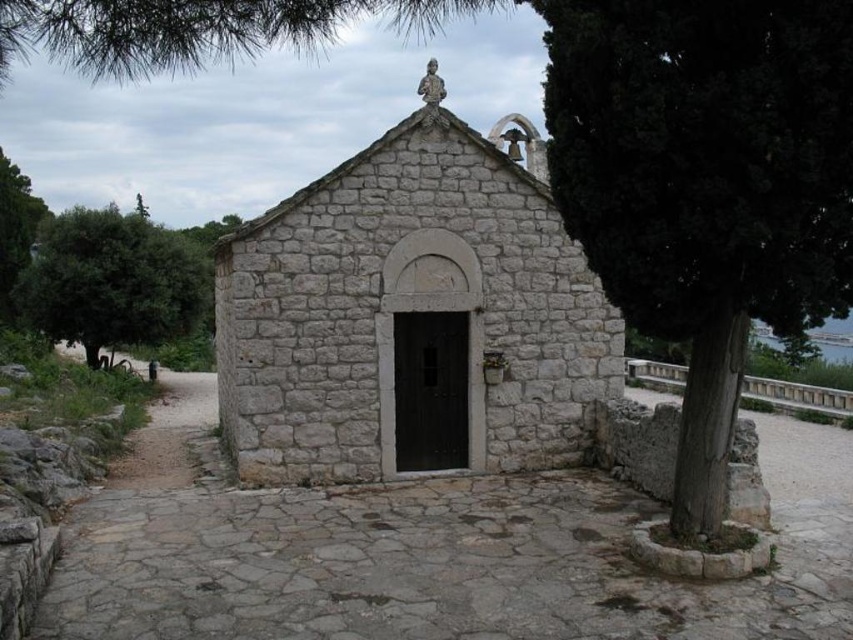
Is gray stone path at center smaller than green leafy tree at left?

Actually, gray stone path at center might be larger than green leafy tree at left.

Can you confirm if gray stone path at center is positioned to the right of green leafy tree at left?

Correct, you'll find gray stone path at center to the right of green leafy tree at left.

Does point (424, 557) lie in front of point (86, 250)?

Yes, point (424, 557) is in front of point (86, 250).

Where is `gray stone path at center`? The height and width of the screenshot is (640, 853). gray stone path at center is located at coordinates [426, 552].

Is gray stone church at center to the left of green leafy tree at left from the viewer's perspective?

In fact, gray stone church at center is to the right of green leafy tree at left.

Identify the location of gray stone church at center. This screenshot has height=640, width=853. (410, 316).

The image size is (853, 640). I want to click on gray stone church at center, so click(x=410, y=316).

Can you confirm if gray stone path at center is shorter than gray stone church at center?

Yes.

Is gray stone path at center wider than gray stone church at center?

Correct, the width of gray stone path at center exceeds that of gray stone church at center.

Find the location of a particular element. This screenshot has height=640, width=853. gray stone path at center is located at coordinates (426, 552).